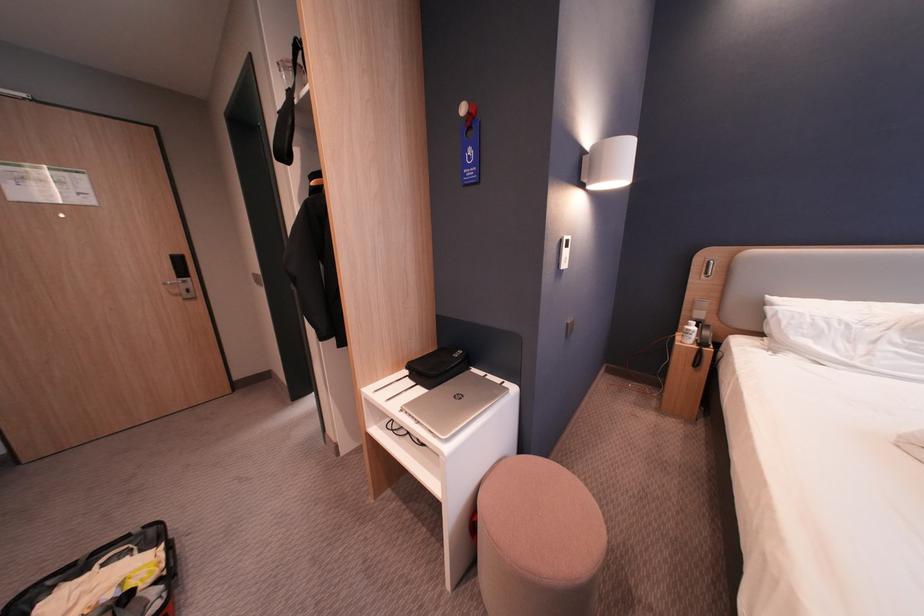
Find the location of a particular element. The image size is (924, 616). pink stool sitting surface is located at coordinates (538, 540).